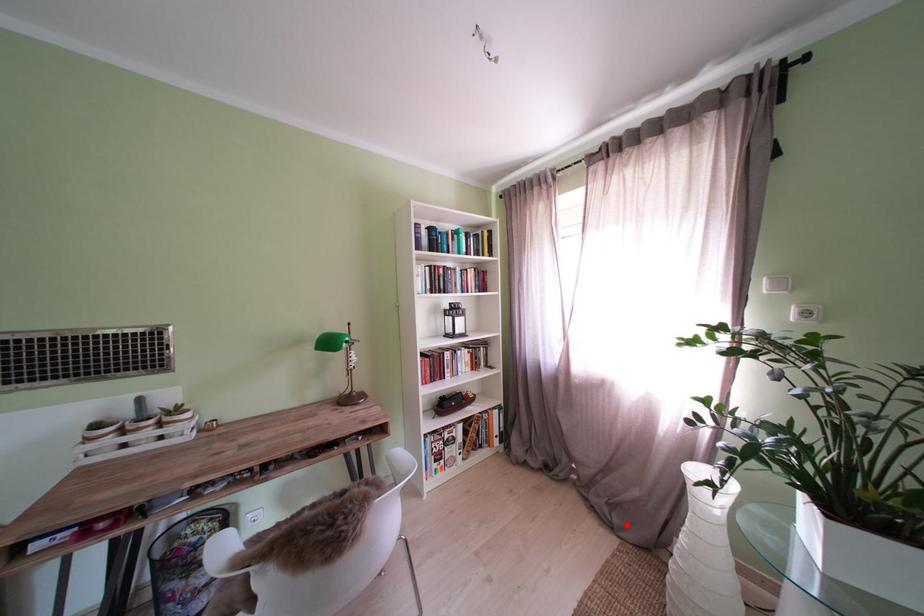
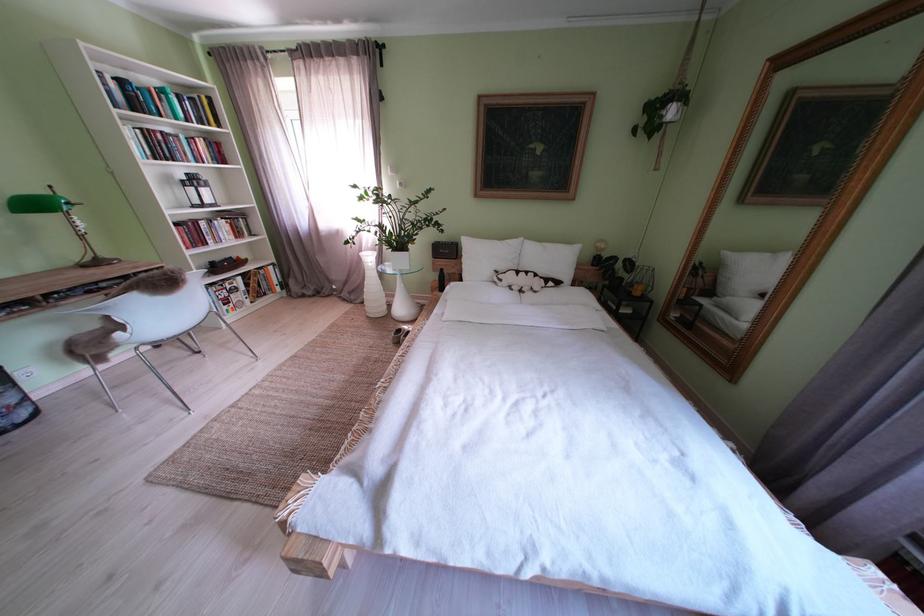
Locate, in the second image, the point that corresponds to the highlighted location in the first image.

(363, 302)